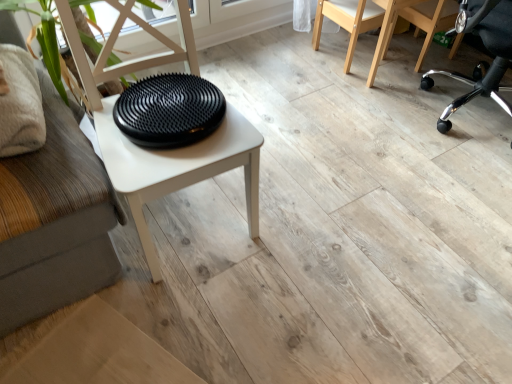
Question: Does natural wood chair at upper right, the third chair from the right, have a greater height compared to black plastic chair at upper right, which is the 2th chair from right to left?

Choices:
 (A) no
 (B) yes

Answer: (B)

Question: Can you confirm if natural wood chair at upper right, arranged as the first chair when viewed from the left, is thinner than black plastic chair at upper right, which is the 2th chair from right to left?

Choices:
 (A) no
 (B) yes

Answer: (A)

Question: Is black plastic chair at upper right, which is the 2th chair from right to left, located within natural wood chair at upper right, arranged as the first chair when viewed from the left?

Choices:
 (A) no
 (B) yes

Answer: (A)

Question: From the image's perspective, does natural wood chair at upper right, the third chair from the right, appear lower than black plastic chair at upper right, the 2th chair from the left?

Choices:
 (A) yes
 (B) no

Answer: (A)

Question: From a real-world perspective, is natural wood chair at upper right, arranged as the first chair when viewed from the left, positioned under black plastic chair at upper right, the 2th chair from the left, based on gravity?

Choices:
 (A) yes
 (B) no

Answer: (B)

Question: Is natural wood chair at upper right, arranged as the first chair when viewed from the left, wider than black plastic chair at upper right, the 2th chair from the left?

Choices:
 (A) no
 (B) yes

Answer: (B)

Question: Can you confirm if natural wood chair at upper right, the third chair from the right, is thinner than black rubberized disc at center?

Choices:
 (A) yes
 (B) no

Answer: (A)

Question: Is natural wood chair at upper right, arranged as the first chair when viewed from the left, looking in the opposite direction of black rubberized disc at center?

Choices:
 (A) no
 (B) yes

Answer: (A)

Question: From the image's perspective, is natural wood chair at upper right, arranged as the first chair when viewed from the left, over black rubberized disc at center?

Choices:
 (A) no
 (B) yes

Answer: (B)

Question: Is natural wood chair at upper right, arranged as the first chair when viewed from the left, outside black rubberized disc at center?

Choices:
 (A) yes
 (B) no

Answer: (A)

Question: Can you confirm if natural wood chair at upper right, the third chair from the right, is positioned to the left of black rubberized disc at center?

Choices:
 (A) no
 (B) yes

Answer: (A)

Question: Does natural wood chair at upper right, the third chair from the right, come in front of black rubberized disc at center?

Choices:
 (A) no
 (B) yes

Answer: (A)

Question: Is natural wood chair at upper right, arranged as the first chair when viewed from the left, surrounded by black rubberized disc at center?

Choices:
 (A) no
 (B) yes

Answer: (A)